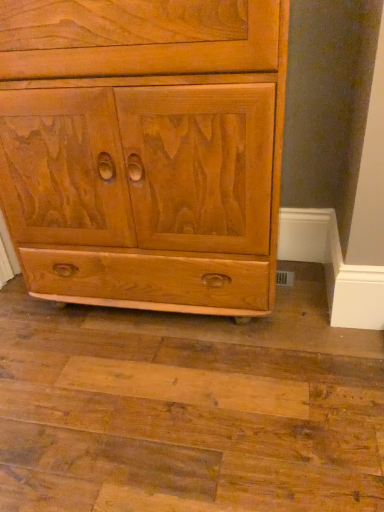
Find the location of `light brown wood cabinet at center`. light brown wood cabinet at center is located at coordinates (144, 150).

Image resolution: width=384 pixels, height=512 pixels. What do you see at coordinates (144, 150) in the screenshot?
I see `light brown wood cabinet at center` at bounding box center [144, 150].

You are a GUI agent. You are given a task and a screenshot of the screen. Output one action in this format:
    pyautogui.click(x=<x>, y=<y>)
    Task: Click on the light brown wood cabinet at center
    The width and height of the screenshot is (384, 512).
    Given the screenshot: What is the action you would take?
    pyautogui.click(x=144, y=150)